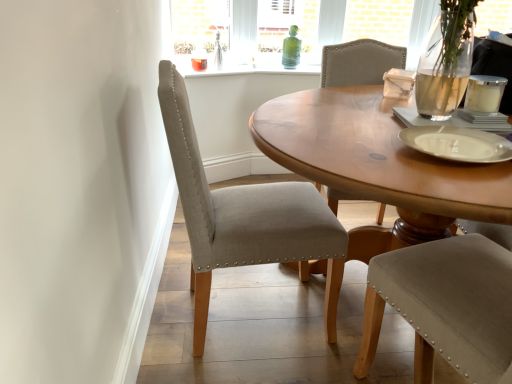
Locate an element on the screen. beige fabric chair at center is located at coordinates (245, 216).

Describe the element at coordinates (245, 216) in the screenshot. I see `beige fabric chair at center` at that location.

Measure the distance between point (420, 145) and camera.

They are 1.03 meters apart.

This screenshot has height=384, width=512. What do you see at coordinates (458, 144) in the screenshot?
I see `white matte platter at right` at bounding box center [458, 144].

Where is `white matte platter at right`? This screenshot has height=384, width=512. white matte platter at right is located at coordinates (458, 144).

What is the approximate height of white matte platter at right?

white matte platter at right is 1.66 inches in height.

In order to face white matte platter at right, should I rotate leftwards or rightwards?

Turn right by 25.045 degrees to look at white matte platter at right.

Locate an element on the screen. beige fabric chair at center is located at coordinates (245, 216).

Considering the relative positions of beige fabric chair at center and white matte platter at right in the image provided, is beige fabric chair at center to the left or to the right of white matte platter at right?

Based on their positions, beige fabric chair at center is located to the left of white matte platter at right.

Is beige fabric chair at center positioned in front of white matte platter at right?

No, it is not.

Is point (193, 282) closer or farther from the camera than point (431, 128)?

Clearly, point (193, 282) is more distant from the camera than point (431, 128).

From the image's perspective, which object appears higher, beige fabric chair at center or white matte platter at right?

white matte platter at right.

From a real-world perspective, between beige fabric chair at center and white matte platter at right, who is vertically higher?

In real-world perspective, white matte platter at right is above.

Considering the sizes of beige fabric chair at center and white matte platter at right in the image, is beige fabric chair at center wider or thinner than white matte platter at right?

In the image, beige fabric chair at center appears to be wider than white matte platter at right.

Considering the relative sizes of beige fabric chair at center and white matte platter at right in the image provided, is beige fabric chair at center shorter than white matte platter at right?

No.

Can you confirm if beige fabric chair at center is smaller than white matte platter at right?

Actually, beige fabric chair at center might be larger than white matte platter at right.

From the picture: Is beige fabric chair at center positioned beyond the bounds of white matte platter at right?

Absolutely, beige fabric chair at center is external to white matte platter at right.

Is beige fabric chair at center in contact with white matte platter at right?

There is a gap between beige fabric chair at center and white matte platter at right.

Could you tell me if beige fabric chair at center is turned towards white matte platter at right?

No, beige fabric chair at center is not aimed at white matte platter at right.

From the picture: How different are the orientations of beige fabric chair at center and white matte platter at right in degrees?

95.4 degrees.

How distant is beige fabric chair at center from white matte platter at right?

beige fabric chair at center is 21.12 inches away from white matte platter at right.

Where is `chair below the white matte platter at right (from the image's perspective)`? This screenshot has width=512, height=384. chair below the white matte platter at right (from the image's perspective) is located at coordinates (245, 216).

Is white matte platter at right to the right of beige fabric chair at center from the viewer's perspective?

Yes, white matte platter at right is to the right of beige fabric chair at center.

Relative to beige fabric chair at center, is white matte platter at right in front or behind?

In the image, white matte platter at right appears in front of beige fabric chair at center.

Between point (485, 150) and point (327, 323), which one is positioned behind?

The point (327, 323) is farther.

From the image's perspective, is white matte platter at right located above or below beige fabric chair at center?

Clearly, from the image's perspective, white matte platter at right is above beige fabric chair at center.

From a real-world perspective, between white matte platter at right and beige fabric chair at center, who is vertically lower?

beige fabric chair at center, from a real-world perspective.

Considering the sizes of white matte platter at right and beige fabric chair at center in the image, is white matte platter at right wider or thinner than beige fabric chair at center?

Considering their sizes, white matte platter at right looks slimmer than beige fabric chair at center.

Considering the sizes of white matte platter at right and beige fabric chair at center in the image, is white matte platter at right taller or shorter than beige fabric chair at center?

white matte platter at right is shorter than beige fabric chair at center.

Which of these two, white matte platter at right or beige fabric chair at center, is bigger?

beige fabric chair at center is bigger.

Would you say white matte platter at right is inside or outside beige fabric chair at center?

white matte platter at right cannot be found inside beige fabric chair at center.

Is white matte platter at right next to beige fabric chair at center and touching it?

white matte platter at right and beige fabric chair at center are clearly separated.

Is white matte platter at right looking in the opposite direction of beige fabric chair at center?

No.

Can you tell me how much white matte platter at right and beige fabric chair at center differ in facing direction?

The angle between the facing direction of white matte platter at right and the facing direction of beige fabric chair at center is 95.4 degrees.

Measure the distance from white matte platter at right to beige fabric chair at center.

white matte platter at right is 21.12 inches from beige fabric chair at center.

The width and height of the screenshot is (512, 384). In order to click on platter on the right of beige fabric chair at center in this screenshot , I will do `click(458, 144)`.

In the image, there is a beige fabric chair at center. Identify the location of platter above it (from the image's perspective). This screenshot has width=512, height=384. (458, 144).

Image resolution: width=512 pixels, height=384 pixels. Find the location of `chair located behind the white matte platter at right`. chair located behind the white matte platter at right is located at coordinates (245, 216).